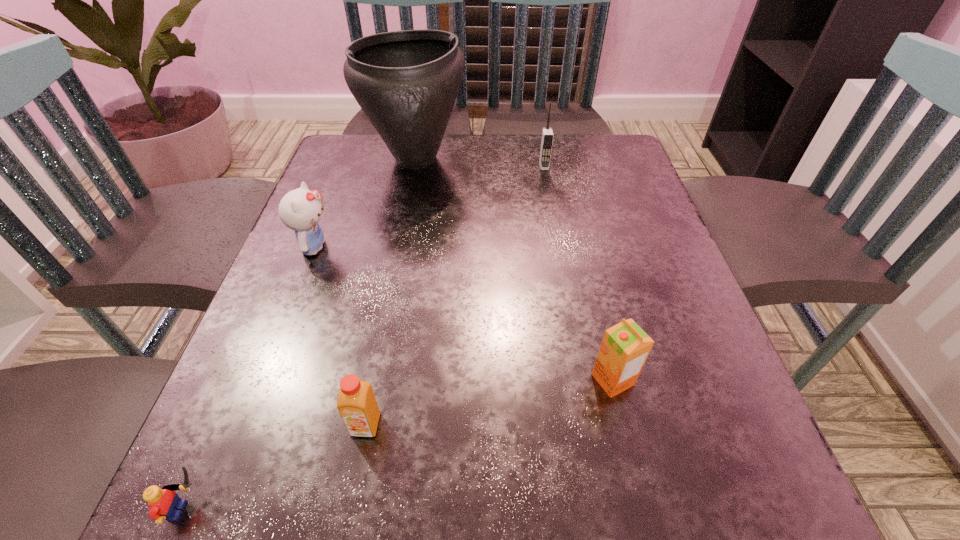
Locate an element on the screen. vacant space situated on the front-facing side of the second object from right to left is located at coordinates (557, 237).

The width and height of the screenshot is (960, 540). Identify the location of free location located 0.360m on the front-facing side of the kitten. (511, 247).

You are a GUI agent. You are given a task and a screenshot of the screen. Output one action in this format:
    pyautogui.click(x=<x>, y=<y>)
    Task: Click on the free location located 0.170m on the left of the fourth farthest object
    
    Given the screenshot: What is the action you would take?
    pyautogui.click(x=483, y=380)

Locate an element on the screen. vacant space located on the front and back of the left orange juice is located at coordinates (350, 508).

Find the location of a particular element. Image resolution: width=960 pixels, height=540 pixels. free space located on the front-facing side of the Lego is located at coordinates (x=444, y=510).

Where is `urn located in the far edge section of the desktop`? The image size is (960, 540). urn located in the far edge section of the desktop is located at coordinates (x=406, y=82).

Find the location of a particular element. Image resolution: width=960 pixels, height=540 pixels. cellular telephone that is at the far edge is located at coordinates (547, 134).

Where is `object present at the near edge`? The height and width of the screenshot is (540, 960). object present at the near edge is located at coordinates (164, 503).

The height and width of the screenshot is (540, 960). In order to click on urn located at the left edge in this screenshot , I will do `click(406, 82)`.

This screenshot has height=540, width=960. I want to click on kitten present at the left edge, so click(x=300, y=210).